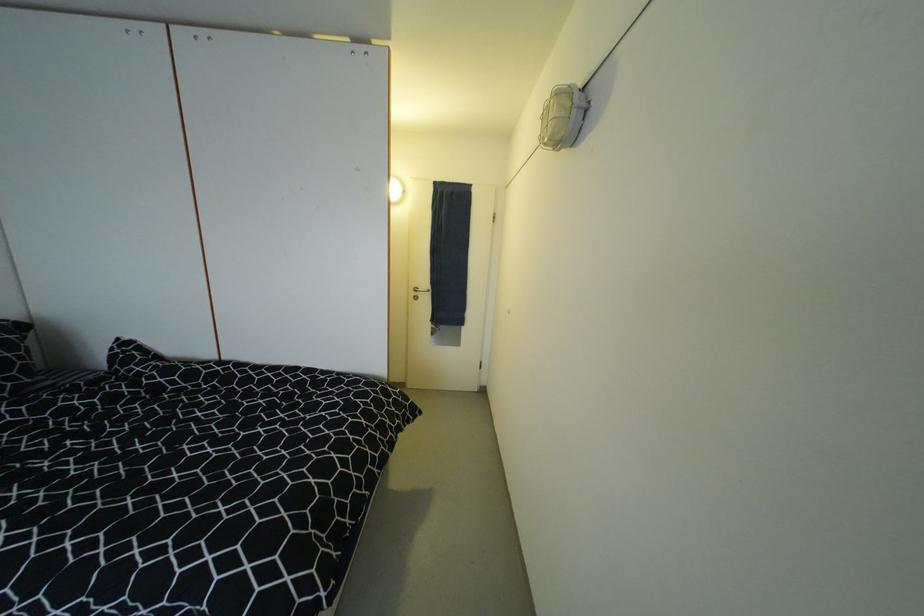
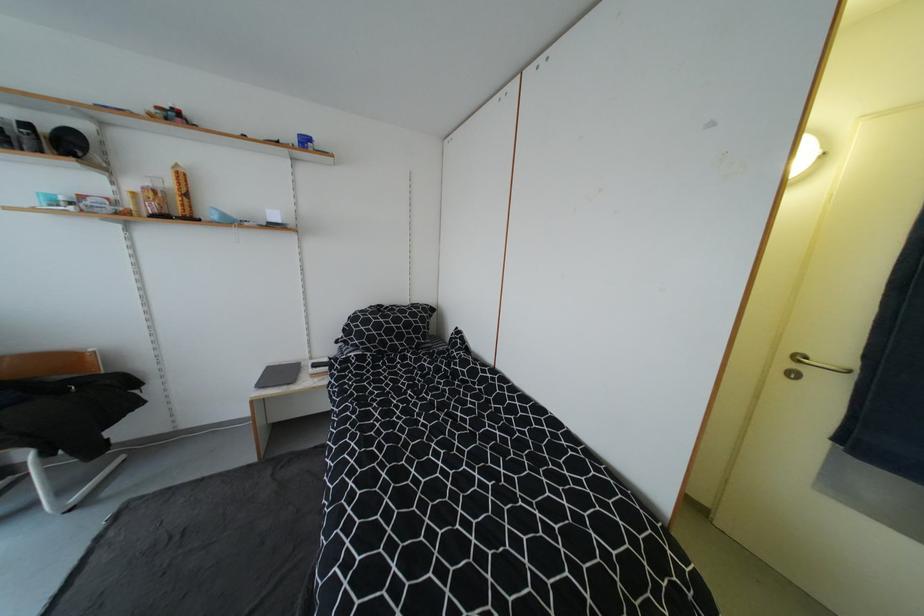
Question: How did the camera likely rotate?

Choices:
 (A) Left
 (B) Right
 (C) Up
 (D) Down

Answer: (A)